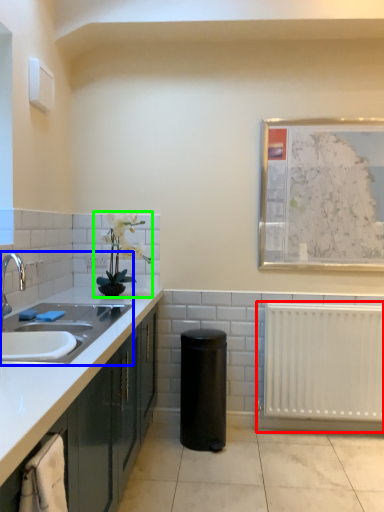
Question: Based on their relative distances, which object is farther from radiator (highlighted by a red box)? Choose from sink (highlighted by a blue box) and houseplant (highlighted by a green box).

Choices:
 (A) sink
 (B) houseplant

Answer: (A)